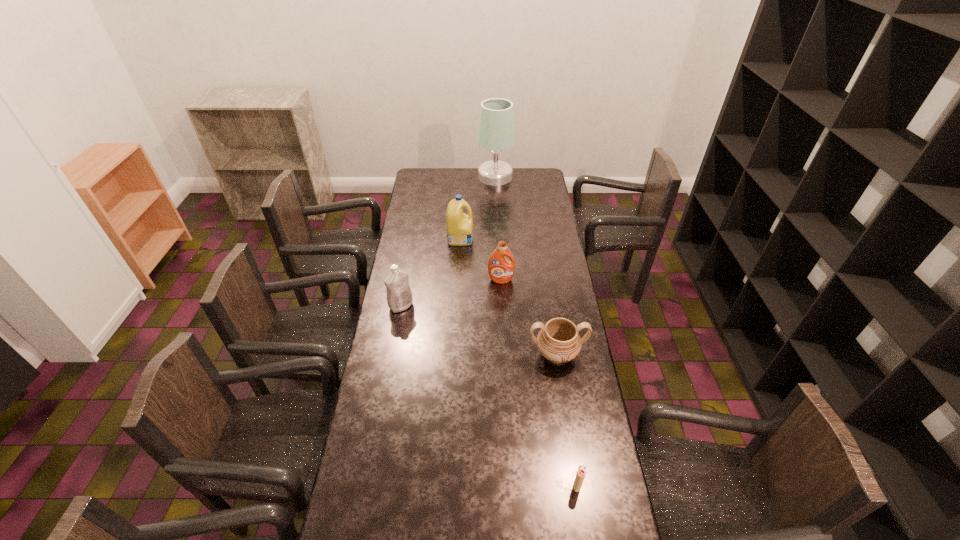
Where is `object that is positioned at the far edge`? The height and width of the screenshot is (540, 960). object that is positioned at the far edge is located at coordinates (496, 133).

Locate an element on the screen. The height and width of the screenshot is (540, 960). object positioned at the left edge is located at coordinates (399, 295).

This screenshot has height=540, width=960. I want to click on urn that is at the right edge, so click(x=558, y=341).

The height and width of the screenshot is (540, 960). What are the coordinates of `igniter at the right edge` in the screenshot? It's located at (581, 472).

Locate an element on the screen. The width and height of the screenshot is (960, 540). vacant space at the far edge of the desktop is located at coordinates (466, 176).

This screenshot has width=960, height=540. In order to click on vacant space at the left edge of the desktop in this screenshot , I will do `click(384, 318)`.

Locate an element on the screen. This screenshot has width=960, height=540. vacant space at the right edge of the desktop is located at coordinates (557, 312).

Image resolution: width=960 pixels, height=540 pixels. In the image, there is a desktop. Identify the location of free space at the far left corner. (436, 184).

The width and height of the screenshot is (960, 540). In order to click on vacant region between the tallest object and the third farthest object in this screenshot , I will do `click(498, 228)`.

Identify the location of empty location between the second farthest object and the fifth farthest object. (509, 296).